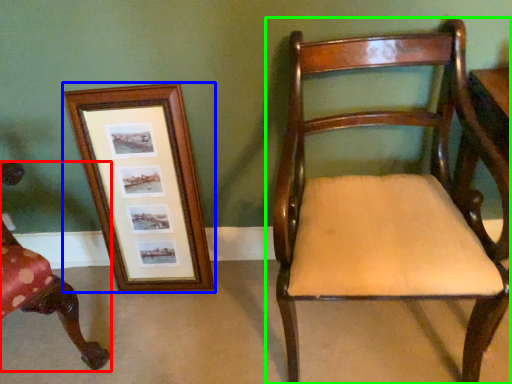
Question: Which object is the farthest from chair (highlighted by a red box)? Choose among these: picture frame (highlighted by a blue box) or chair (highlighted by a green box).

Choices:
 (A) picture frame
 (B) chair

Answer: (B)